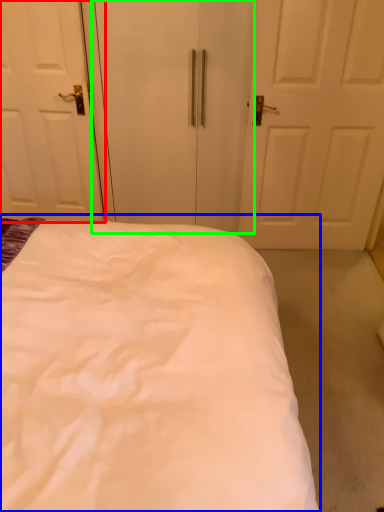
Question: Which object is positioned farthest from door (highlighted by a red box)? Select from bed (highlighted by a blue box) and screen door (highlighted by a green box).

Choices:
 (A) bed
 (B) screen door

Answer: (A)